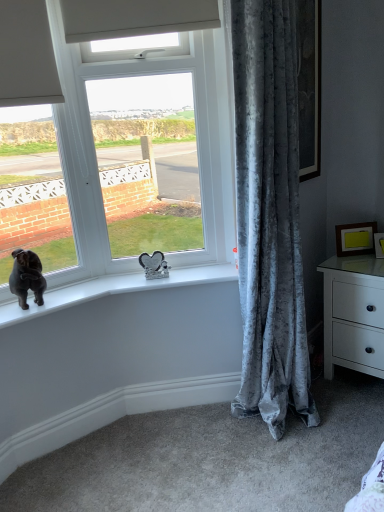
The width and height of the screenshot is (384, 512). What do you see at coordinates (95, 152) in the screenshot? I see `white plastic window at center` at bounding box center [95, 152].

Describe the element at coordinates (379, 244) in the screenshot. I see `matte gold picture frame at right, which is the second picture frame in left-to-right order` at that location.

In order to click on white glossy chest of drawers at right in this screenshot , I will do `click(353, 314)`.

Locate an element on the screen. velvet gray curtain at right is located at coordinates (269, 215).

Measure the distance between point (279, 80) and camera.

1.58 meters.

Measure the distance between yellow matte picture frame at upper right, which ranks as the 2th picture frame in right-to-left order, and camera.

yellow matte picture frame at upper right, which ranks as the 2th picture frame in right-to-left order, and camera are 2.21 meters apart from each other.

The height and width of the screenshot is (512, 384). In order to click on black velvet dog at window in this screenshot , I will do `click(27, 277)`.

Image resolution: width=384 pixels, height=512 pixels. In order to click on white plastic window at center in this screenshot , I will do [95, 152].

Is yellow matte picture frame at upper right, positioned as the 1th picture frame in left-to-right order, completely or partially inside black velvet dog at window?

No.

From a real-world perspective, who is located lower, black velvet dog at window or yellow matte picture frame at upper right, which ranks as the 2th picture frame in right-to-left order?

In real-world perspective, yellow matte picture frame at upper right, which ranks as the 2th picture frame in right-to-left order, is lower.

You are a GUI agent. You are given a task and a screenshot of the screen. Output one action in this format:
    pyautogui.click(x=<x>, y=<y>)
    Task: Click on the dog located below the yellow matte picture frame at upper right, positioned as the 1th picture frame in left-to-right order (from the image's perspective)
    
    Given the screenshot: What is the action you would take?
    pyautogui.click(x=27, y=277)

Is black velvet dog at window wider or thinner than yellow matte picture frame at upper right, which ranks as the 2th picture frame in right-to-left order?

In the image, black velvet dog at window appears to be wider than yellow matte picture frame at upper right, which ranks as the 2th picture frame in right-to-left order.

Is the depth of matte gold picture frame at right, which is the second picture frame in left-to-right order, greater than that of black velvet dog at window?

Yes, matte gold picture frame at right, which is the second picture frame in left-to-right order, is further from the camera.

Considering the positions of point (378, 242) and point (39, 284), is point (378, 242) closer or farther from the camera than point (39, 284)?

Point (378, 242) appears to be farther away from the viewer than point (39, 284).

Is matte gold picture frame at right, which is the second picture frame in left-to-right order, oriented towards black velvet dog at window?

No.

Is matte gold picture frame at right, which is the second picture frame in left-to-right order, far away from black velvet dog at window?

Yes, matte gold picture frame at right, which is the second picture frame in left-to-right order, and black velvet dog at window are quite far apart.

Is black velvet dog at window touching white glossy chest of drawers at right?

black velvet dog at window and white glossy chest of drawers at right are not in contact.

Is black velvet dog at window wider than white glossy chest of drawers at right?

In fact, black velvet dog at window might be narrower than white glossy chest of drawers at right.

Is black velvet dog at window further to camera compared to white glossy chest of drawers at right?

No, it is in front of white glossy chest of drawers at right.

From the image's perspective, is black velvet dog at window above white glossy chest of drawers at right?

Correct, black velvet dog at window appears higher than white glossy chest of drawers at right in the image.

Is velvet gray curtain at right inside the boundaries of white glossy chest of drawers at right, or outside?

velvet gray curtain at right exists outside the volume of white glossy chest of drawers at right.

From the image's perspective, who appears lower, velvet gray curtain at right or white glossy chest of drawers at right?

white glossy chest of drawers at right is shown below in the image.

Based on the photo, from a real-world perspective, between velvet gray curtain at right and white glossy chest of drawers at right, who is vertically higher?

From a 3D spatial view, velvet gray curtain at right is above.

Which is more to the left, velvet gray curtain at right or white glossy chest of drawers at right?

Positioned to the left is velvet gray curtain at right.

Is white glossy chest of drawers at right next to white plastic window at center?

white glossy chest of drawers at right is not next to white plastic window at center, and they're not touching.

Is white glossy chest of drawers at right located outside white plastic window at center?

Yes, white glossy chest of drawers at right is located beyond the bounds of white plastic window at center.

Considering the relative sizes of white glossy chest of drawers at right and white plastic window at center in the image provided, is white glossy chest of drawers at right taller than white plastic window at center?

No, white glossy chest of drawers at right is not taller than white plastic window at center.

Is white glossy chest of drawers at right in front of or behind white plastic window at center in the image?

white glossy chest of drawers at right is behind white plastic window at center.

How different are the orientations of white glossy chest of drawers at right and velvet gray curtain at right in degrees?

The angle between the facing direction of white glossy chest of drawers at right and the facing direction of velvet gray curtain at right is 91.6 degrees.

Which object is more forward, white glossy chest of drawers at right or velvet gray curtain at right?

velvet gray curtain at right is in front.

In order to click on curtain above the white glossy chest of drawers at right (from the image's perspective) in this screenshot , I will do `click(269, 215)`.

From a real-world perspective, who is located lower, white glossy chest of drawers at right or velvet gray curtain at right?

white glossy chest of drawers at right.

Considering the positions of point (361, 231) and point (20, 273), is point (361, 231) closer or farther from the camera than point (20, 273)?

Point (361, 231) appears to be farther away from the viewer than point (20, 273).

Can you confirm if yellow matte picture frame at upper right, positioned as the 1th picture frame in left-to-right order, is positioned to the left of black velvet dog at window?

Incorrect, yellow matte picture frame at upper right, positioned as the 1th picture frame in left-to-right order, is not on the left side of black velvet dog at window.

Which of these two, yellow matte picture frame at upper right, which ranks as the 2th picture frame in right-to-left order, or black velvet dog at window, is thinner?

yellow matte picture frame at upper right, which ranks as the 2th picture frame in right-to-left order, is thinner.

Locate an element on the screen. dog that is on the left side of yellow matte picture frame at upper right, which ranks as the 2th picture frame in right-to-left order is located at coordinates [27, 277].

The image size is (384, 512). In order to click on dog above the yellow matte picture frame at upper right, which ranks as the 2th picture frame in right-to-left order (from a real-world perspective) in this screenshot , I will do `click(27, 277)`.

From the black velvet dog at window, count 1st picture frames backward and point to it. Please provide its 2D coordinates.

[(379, 244)]

Estimate the real-world distances between objects in this image. Which object is closer to white glossy chest of drawers at right, black velvet dog at window or yellow matte picture frame at upper right, which ranks as the 2th picture frame in right-to-left order?

yellow matte picture frame at upper right, which ranks as the 2th picture frame in right-to-left order.

Which object lies nearer to the anchor point velvet gray curtain at right, matte gold picture frame at right, which is the second picture frame in left-to-right order, or yellow matte picture frame at upper right, which ranks as the 2th picture frame in right-to-left order?

The object closer to velvet gray curtain at right is yellow matte picture frame at upper right, which ranks as the 2th picture frame in right-to-left order.

When comparing their distances from yellow matte picture frame at upper right, which ranks as the 2th picture frame in right-to-left order, does matte gold picture frame at right, which is the second picture frame in left-to-right order, or velvet gray curtain at right seem further?

velvet gray curtain at right is positioned further to the anchor yellow matte picture frame at upper right, which ranks as the 2th picture frame in right-to-left order.

Considering their positions, is velvet gray curtain at right positioned closer to matte gold picture frame at right, which is the second picture frame in left-to-right order, than black velvet dog at window?

Among the two, velvet gray curtain at right is located nearer to matte gold picture frame at right, which is the second picture frame in left-to-right order.

Based on their spatial positions, is white glossy chest of drawers at right or white plastic window at center closer to black velvet dog at window?

white plastic window at center is closer to black velvet dog at window.

Estimate the real-world distances between objects in this image. Which object is further from black velvet dog at window, white plastic window at center or velvet gray curtain at right?

The object further to black velvet dog at window is velvet gray curtain at right.

Based on their spatial positions, is white plastic window at center or yellow matte picture frame at upper right, positioned as the 1th picture frame in left-to-right order, closer to black velvet dog at window?

The object closer to black velvet dog at window is white plastic window at center.

When comparing their distances from black velvet dog at window, does yellow matte picture frame at upper right, positioned as the 1th picture frame in left-to-right order, or white plastic window at center seem further?

Among the two, yellow matte picture frame at upper right, positioned as the 1th picture frame in left-to-right order, is located further to black velvet dog at window.

At what (x,y) coordinates should I click in order to perform the action: click on the chest of drawers located between black velvet dog at window and matte gold picture frame at right, which is the second picture frame in left-to-right order, in the left-right direction. Please return your answer as a coordinate pair (x, y). Looking at the image, I should click on (353, 314).

Where is `curtain situated between white plastic window at center and matte gold picture frame at right, the first picture frame from the right, from left to right`? The width and height of the screenshot is (384, 512). curtain situated between white plastic window at center and matte gold picture frame at right, the first picture frame from the right, from left to right is located at coordinates (269, 215).

Identify the location of curtain between black velvet dog at window and yellow matte picture frame at upper right, positioned as the 1th picture frame in left-to-right order, in the horizontal direction. This screenshot has width=384, height=512. (269, 215).

The height and width of the screenshot is (512, 384). What are the coordinates of `the chest of drawers positioned between velvet gray curtain at right and matte gold picture frame at right, the first picture frame from the right, from near to far` in the screenshot? It's located at (353, 314).